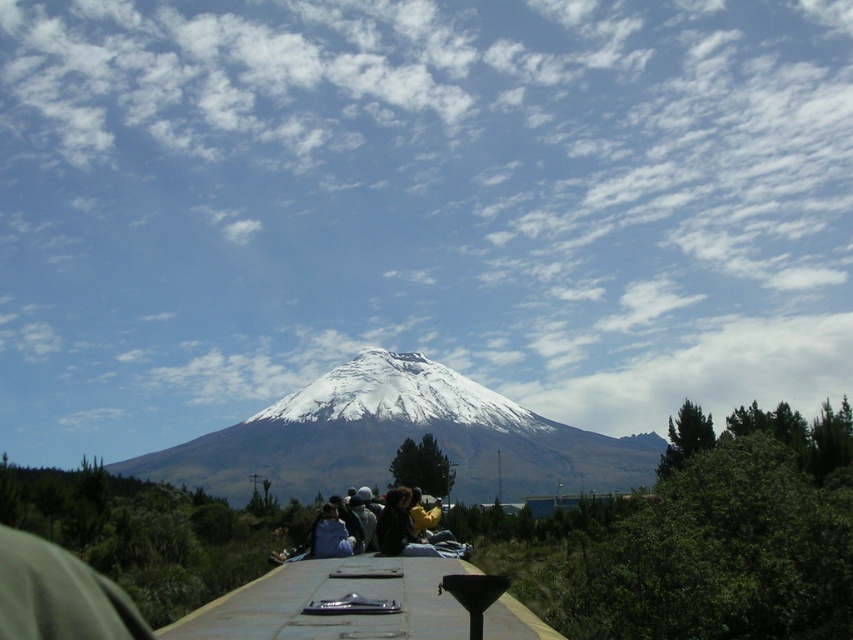
Question: Which point is closer to the camera taking this photo?

Choices:
 (A) (625, 436)
 (B) (408, 524)
 (C) (428, 388)

Answer: (B)

Question: Is snowy volcanic peak at center smaller than dark brown fabric jacket at center?

Choices:
 (A) no
 (B) yes

Answer: (A)

Question: Which of these objects is positioned farthest from the dark brown fabric jacket at center?

Choices:
 (A) white snow-covered mountain at center
 (B) snowy volcanic peak at center

Answer: (A)

Question: Does snowy volcanic peak at center have a larger size compared to white snow-covered mountain at center?

Choices:
 (A) yes
 (B) no

Answer: (A)

Question: Which of the following is the farthest from the observer?

Choices:
 (A) dark brown fabric jacket at center
 (B) white snow-covered mountain at center

Answer: (B)

Question: Where is snowy volcanic peak at center located in relation to dark brown fabric jacket at center in the image?

Choices:
 (A) above
 (B) below

Answer: (B)